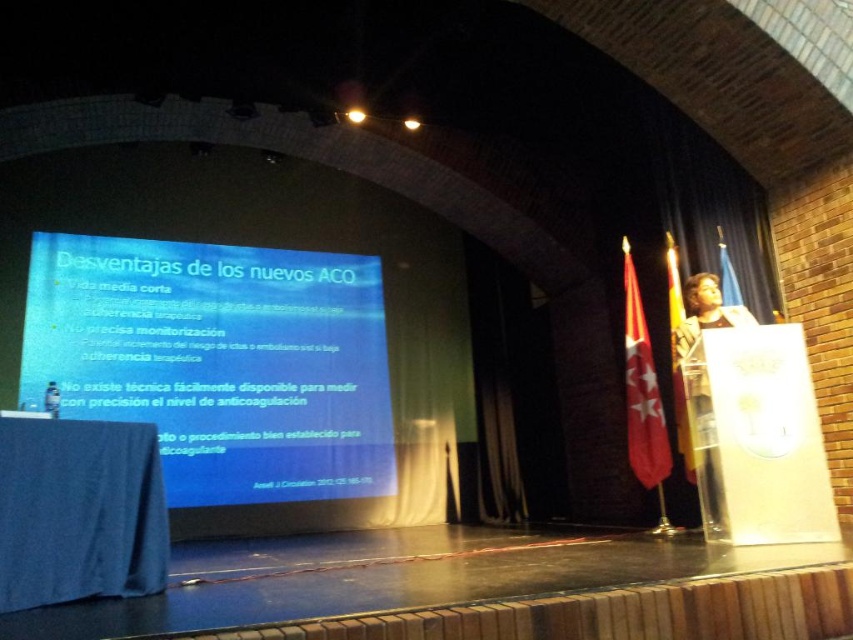
Which of these two, blue glossy projector screen at center or dark brown leather jacket at right, stands shorter?

dark brown leather jacket at right is shorter.

Does blue glossy projector screen at center come behind dark brown leather jacket at right?

That is True.

Find the location of `blue glossy projector screen at center`. blue glossy projector screen at center is located at coordinates (218, 362).

This screenshot has height=640, width=853. Find the location of `blue glossy projector screen at center`. blue glossy projector screen at center is located at coordinates (218, 362).